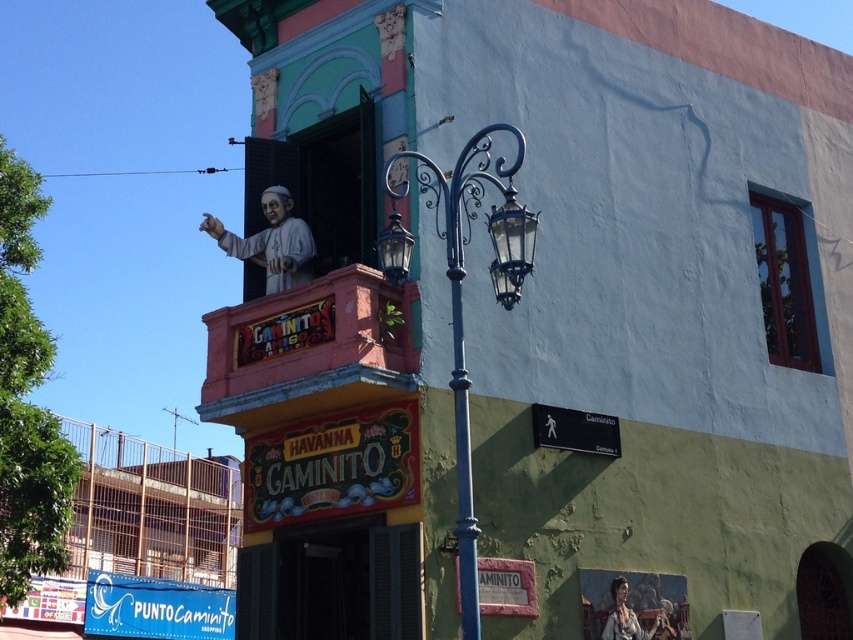
Is wooden frame window at upper right bigger than matte white statue at upper center?

Actually, wooden frame window at upper right might be smaller than matte white statue at upper center.

Is point (758, 244) closer to viewer compared to point (265, 262)?

No, (758, 244) is behind (265, 262).

You are a GUI agent. You are given a task and a screenshot of the screen. Output one action in this format:
    pyautogui.click(x=<x>, y=<y>)
    Task: Click on the wooden frame window at upper right
    The width and height of the screenshot is (853, 640).
    Given the screenshot: What is the action you would take?
    pyautogui.click(x=784, y=282)

Is wooden painted balcony at upper center smaller than matte black lamp at upper center?

No, wooden painted balcony at upper center is not smaller than matte black lamp at upper center.

Between point (283, 292) and point (389, 225), which one is positioned behind?

Point (283, 292)

Locate an element on the screen. Image resolution: width=853 pixels, height=640 pixels. wooden painted balcony at upper center is located at coordinates click(308, 349).

Is polished metal streetlamp at center to the right of wooden frame window at upper right from the viewer's perspective?

In fact, polished metal streetlamp at center is to the left of wooden frame window at upper right.

Between point (460, 276) and point (764, 308), which one is positioned behind?

Point (764, 308)

The height and width of the screenshot is (640, 853). Find the location of `polished metal streetlamp at center`. polished metal streetlamp at center is located at coordinates [x=460, y=298].